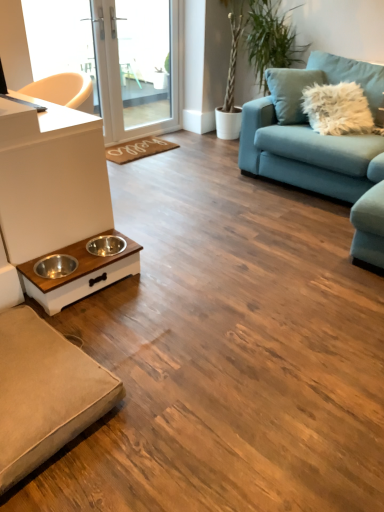
Find the location of a particular element. This screenshot has width=384, height=512. teal fabric couch at upper right, which appears as the 2th studio couch when ordered from the bottom is located at coordinates (322, 150).

Measure the distance between point (319, 190) and camera.

They are 9.77 feet apart.

I want to click on beige fabric studio couch at lower left, the 2th studio couch positioned from the top, so click(x=44, y=393).

Describe the element at coordinates (138, 149) in the screenshot. I see `brown woven mat at center` at that location.

Identify the location of white glossy screen door at upper center. The width and height of the screenshot is (384, 512). (132, 74).

Identify the location of white wood pet feeder at lower left. (80, 274).

Is green leafy plant at upper right not within white wood pet feeder at lower left?

Yes.

How many degrees apart are the facing directions of green leafy plant at upper right and white wood pet feeder at lower left?

There is a 91.1-degree angle between the facing directions of green leafy plant at upper right and white wood pet feeder at lower left.

From the image's perspective, is green leafy plant at upper right located above white wood pet feeder at lower left?

Yes, from the image's perspective, green leafy plant at upper right is above white wood pet feeder at lower left.

Is point (259, 0) closer to camera compared to point (74, 277)?

That is False.

Looking at the image, does green leafy plant at upper right seem bigger or smaller compared to teal fabric couch at upper right, the first studio couch from the back?

In the image, green leafy plant at upper right appears to be smaller than teal fabric couch at upper right, the first studio couch from the back.

Is green leafy plant at upper right placed right next to teal fabric couch at upper right, the first studio couch from the back?

There is a gap between green leafy plant at upper right and teal fabric couch at upper right, the first studio couch from the back.

Could you tell me if green leafy plant at upper right is turned towards teal fabric couch at upper right, which appears as the 2th studio couch when ordered from the bottom?

No, green leafy plant at upper right does not turn towards teal fabric couch at upper right, which appears as the 2th studio couch when ordered from the bottom.

What's the angular difference between green leafy plant at upper right and teal fabric couch at upper right, the first studio couch from the back,'s facing directions?

The angle between the facing direction of green leafy plant at upper right and the facing direction of teal fabric couch at upper right, the first studio couch from the back, is 2.26 degrees.

From a real-world perspective, is white glossy screen door at upper center above or below white wood pet feeder at lower left?

Clearly, from a real-world perspective, white glossy screen door at upper center is above white wood pet feeder at lower left.

Could you tell me if white glossy screen door at upper center is turned towards white wood pet feeder at lower left?

No, white glossy screen door at upper center is not turned towards white wood pet feeder at lower left.

From the picture: In terms of size, does white glossy screen door at upper center appear bigger or smaller than white wood pet feeder at lower left?

Considering their sizes, white glossy screen door at upper center takes up more space than white wood pet feeder at lower left.

Does point (265, 28) appear closer or farther from the camera than point (112, 79)?

Point (265, 28) is closer to the camera than point (112, 79).

How far apart are green leafy plant at upper right and white glossy screen door at upper center?

The distance of green leafy plant at upper right from white glossy screen door at upper center is 1.04 meters.

Does green leafy plant at upper right have a smaller size compared to white glossy screen door at upper center?

Incorrect, green leafy plant at upper right is not smaller in size than white glossy screen door at upper center.

Is green leafy plant at upper right taller or shorter than white glossy screen door at upper center?

In the image, green leafy plant at upper right appears to be taller than white glossy screen door at upper center.

From a real-world perspective, is white glossy screen door at upper center below brown woven mat at center?

Incorrect, from a real-world perspective, white glossy screen door at upper center is higher than brown woven mat at center.

Between white glossy screen door at upper center and brown woven mat at center, which one has smaller width?

white glossy screen door at upper center is thinner.

From the image's perspective, is white glossy screen door at upper center positioned above or below brown woven mat at center?

white glossy screen door at upper center is above brown woven mat at center.

Can you confirm if white glossy screen door at upper center is shorter than brown woven mat at center?

No.

What's the angular difference between green leafy plant at upper right and beige fabric studio couch at lower left, marked as the first studio couch in a left-to-right arrangement,'s facing directions?

The angular difference between green leafy plant at upper right and beige fabric studio couch at lower left, marked as the first studio couch in a left-to-right arrangement, is 91.6 degrees.

Does green leafy plant at upper right come behind beige fabric studio couch at lower left, which is counted as the second studio couch, starting from the right?

Yes, the depth of green leafy plant at upper right is greater than that of beige fabric studio couch at lower left, which is counted as the second studio couch, starting from the right.

Considering the relative sizes of green leafy plant at upper right and beige fabric studio couch at lower left, which is the first studio couch in bottom-to-top order, in the image provided, is green leafy plant at upper right thinner than beige fabric studio couch at lower left, which is the first studio couch in bottom-to-top order,?

Yes, green leafy plant at upper right is thinner than beige fabric studio couch at lower left, which is the first studio couch in bottom-to-top order.

From the image's perspective, is green leafy plant at upper right positioned above or below beige fabric studio couch at lower left, the second studio couch from the back?

Clearly, from the image's perspective, green leafy plant at upper right is above beige fabric studio couch at lower left, the second studio couch from the back.

Is point (269, 67) closer to camera compared to point (42, 180)?

No, (269, 67) is behind (42, 180).

Is green leafy plant at upper right far away from white matte counter top at left?

Indeed, green leafy plant at upper right is not near white matte counter top at left.

Locate an element on the screen. This screenshot has width=384, height=512. plant behind the white wood pet feeder at lower left is located at coordinates (270, 39).

Find the location of a particular element. studio couch that is the 1st one below the green leafy plant at upper right (from a real-world perspective) is located at coordinates (322, 150).

Consider the image. Estimate the real-world distances between objects in this image. Which object is closer to brown woven mat at center, white glossy screen door at upper center or green leafy plant at upper right?

white glossy screen door at upper center.

When comparing their distances from beige fabric studio couch at lower left, marked as the first studio couch in a left-to-right arrangement, does teal fabric couch at upper right, which appears as the 2th studio couch when viewed from the left, or white glossy screen door at upper center seem further?

white glossy screen door at upper center is further to beige fabric studio couch at lower left, marked as the first studio couch in a left-to-right arrangement.

Which object lies further to the anchor point green leafy plant at upper right, white glossy screen door at upper center or white matte counter top at left?

white matte counter top at left is further to green leafy plant at upper right.

From the image, which object appears to be farther from brown woven mat at center, teal fabric couch at upper right, which appears as the 2th studio couch when ordered from the bottom, or green leafy plant at upper right?

The object further to brown woven mat at center is green leafy plant at upper right.

Considering their positions, is brown woven mat at center positioned closer to white matte counter top at left than white glossy screen door at upper center?

brown woven mat at center lies closer to white matte counter top at left than the other object.

When comparing their distances from beige fabric studio couch at lower left, which appears as the 1th studio couch when viewed from the front, does teal fabric couch at upper right, which appears as the 2th studio couch when ordered from the bottom, or white matte counter top at left seem closer?

The object closer to beige fabric studio couch at lower left, which appears as the 1th studio couch when viewed from the front, is white matte counter top at left.

Estimate the real-world distances between objects in this image. Which object is further from white matte counter top at left, white wood pet feeder at lower left or green leafy plant at upper right?

The object further to white matte counter top at left is green leafy plant at upper right.

Looking at the image, which one is located further to white matte counter top at left, teal fabric couch at upper right, the first studio couch from the top, or brown woven mat at center?

Based on the image, teal fabric couch at upper right, the first studio couch from the top, appears to be further to white matte counter top at left.

The image size is (384, 512). I want to click on plant located between white glossy screen door at upper center and teal fabric couch at upper right, placed as the 2th studio couch when sorted from front to back, in the left-right direction, so click(x=270, y=39).

Where is `screen door located between brown woven mat at center and green leafy plant at upper right in the left-right direction`? screen door located between brown woven mat at center and green leafy plant at upper right in the left-right direction is located at coordinates (132, 74).

The height and width of the screenshot is (512, 384). I want to click on counter top between beige fabric studio couch at lower left, the 2th studio couch positioned from the top, and green leafy plant at upper right in the front-back direction, so click(x=50, y=178).

You are a GUI agent. You are given a task and a screenshot of the screen. Output one action in this format:
    pyautogui.click(x=<x>, y=<y>)
    Task: Click on the studio couch between green leafy plant at upper right and beige fabric studio couch at lower left, which appears as the 1th studio couch when viewed from the front, from top to bottom
    Image resolution: width=384 pixels, height=512 pixels.
    Given the screenshot: What is the action you would take?
    pyautogui.click(x=322, y=150)